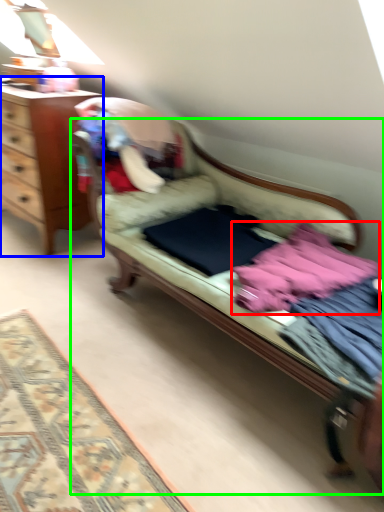
Question: Which is farther away from baby clothe (highlighted by a red box)? desk (highlighted by a blue box) or studio couch (highlighted by a green box)?

Choices:
 (A) desk
 (B) studio couch

Answer: (A)